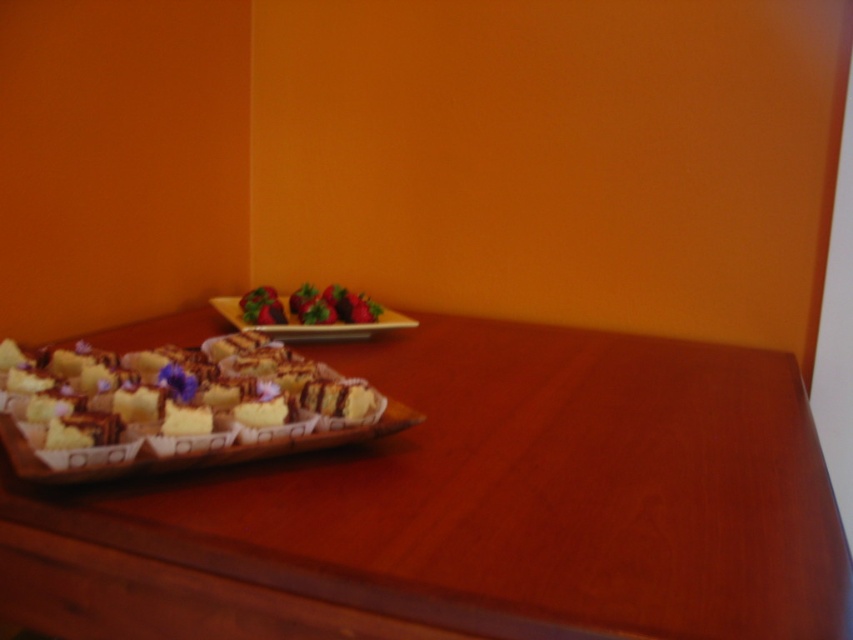
You are a customer at a bakery and see the shiny red strawberries at center on the table. Where exactly are they placed in relation to the other items on the table?

The shiny red strawberries at center are located at point (331, 305) on the table, which places them near the center area compared to the other items.

You are a customer at a bakery and see the wooden table at lower left and the white paper cupcake at lower left. Which item is closer to you?

The wooden table at lower left is closer to you because it is in front of the white paper cupcake at lower left.

You are a food stylist arranging items on a wooden table. You have a shiny red strawberries at center and a wooden rectangular platter at center. Which item takes up more horizontal space on the table?

The wooden rectangular platter at center takes up more horizontal space because the shiny red strawberries at center are narrower than it.